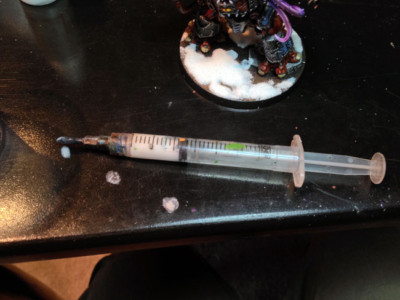
You are a GUI agent. You are given a task and a screenshot of the screen. Output one action in this format:
    pyautogui.click(x=<x>, y=<y>)
    Task: Click on the counter
    
    Given the screenshot: What is the action you would take?
    point(30,91)